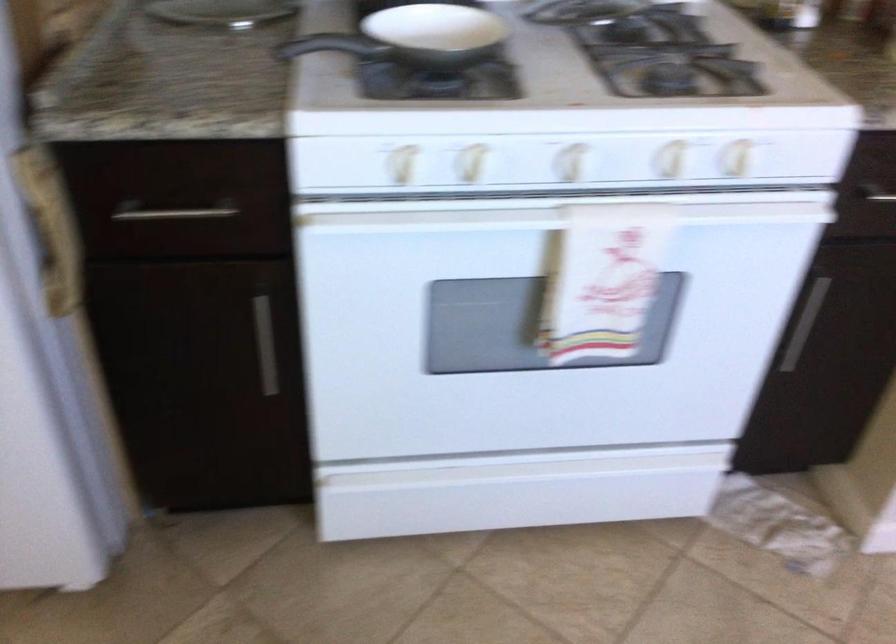
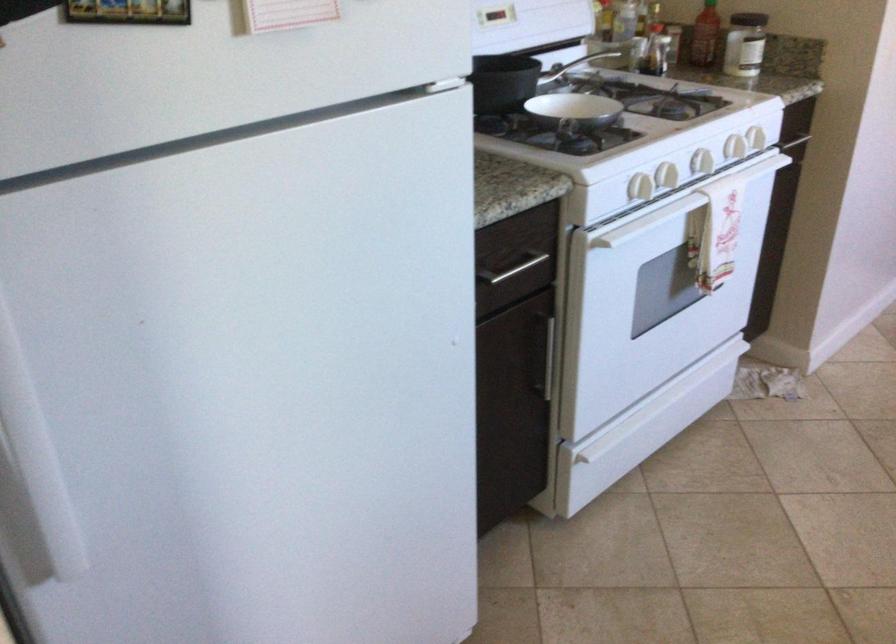
In the second image, find the point that corresponds to the point at 435,256 in the first image.

(679, 205)